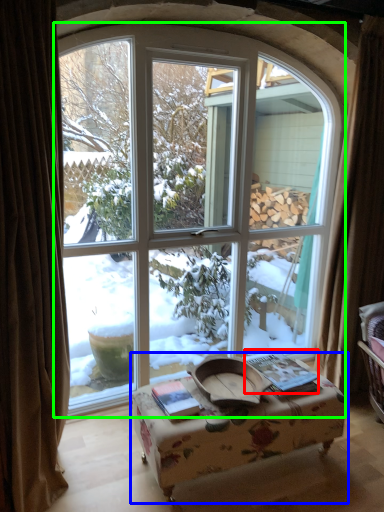
Question: Which is farther away from book (highlighted by a red box)? table (highlighted by a blue box) or window (highlighted by a green box)?

Choices:
 (A) table
 (B) window

Answer: (B)